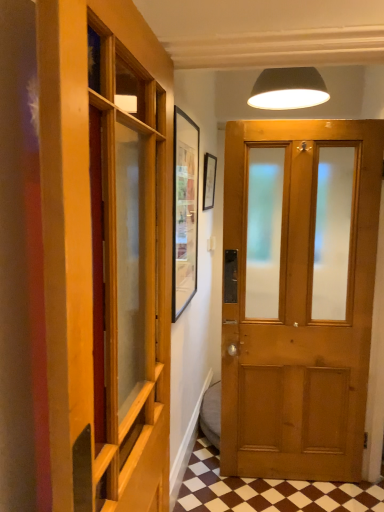
Question: From the image's perspective, is brown checkered tile at lower center above wooden paneling at left?

Choices:
 (A) yes
 (B) no

Answer: (B)

Question: Is brown checkered tile at lower center beside wooden paneling at left?

Choices:
 (A) no
 (B) yes

Answer: (A)

Question: Does brown checkered tile at lower center have a greater width compared to wooden paneling at left?

Choices:
 (A) yes
 (B) no

Answer: (A)

Question: Is brown checkered tile at lower center far away from wooden paneling at left?

Choices:
 (A) yes
 (B) no

Answer: (A)

Question: Is brown checkered tile at lower center thinner than wooden paneling at left?

Choices:
 (A) no
 (B) yes

Answer: (A)

Question: Is brown checkered tile at lower center surrounding wooden paneling at left?

Choices:
 (A) yes
 (B) no

Answer: (B)

Question: Is matte wooden door at center wider than matte black lampshade at upper center?

Choices:
 (A) no
 (B) yes

Answer: (A)

Question: From the image's perspective, is matte wooden door at center located above matte black lampshade at upper center?

Choices:
 (A) yes
 (B) no

Answer: (B)

Question: Is matte wooden door at center positioned before matte black lampshade at upper center?

Choices:
 (A) no
 (B) yes

Answer: (B)

Question: Is matte wooden door at center completely or partially outside of matte black lampshade at upper center?

Choices:
 (A) yes
 (B) no

Answer: (A)

Question: Does matte wooden door at center lie behind matte black lampshade at upper center?

Choices:
 (A) no
 (B) yes

Answer: (A)

Question: Considering the relative positions of matte wooden door at center and matte black lampshade at upper center in the image provided, is matte wooden door at center to the right of matte black lampshade at upper center from the viewer's perspective?

Choices:
 (A) yes
 (B) no

Answer: (B)

Question: Does wooden paneling at left have a greater width compared to matte wooden door at center?

Choices:
 (A) no
 (B) yes

Answer: (B)